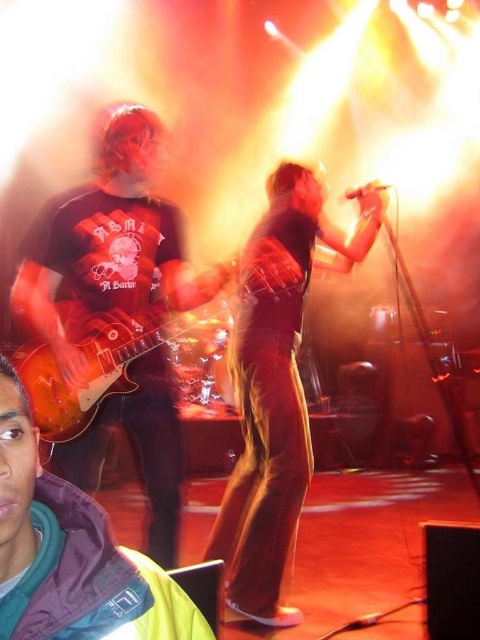
You are a photographer trying to capture a photo of the shiny black microphone at center and the matte black guitar at center during the live music performance. From the audience perspective, which object is positioned to the left?

The matte black guitar at center is positioned to the left of the shiny black microphone at center.

You are standing in the audience at the live music performance. You want to toss a small flower bouquet to the musician holding the matte black guitar at center. If you can throw accurately up to 6 feet, will your throw reach them?

The distance between you and the matte black guitar at center is 6.46 feet. Since your maximum throwing distance is 6 feet, you cannot reach the musician holding the matte black guitar at center with your throw.